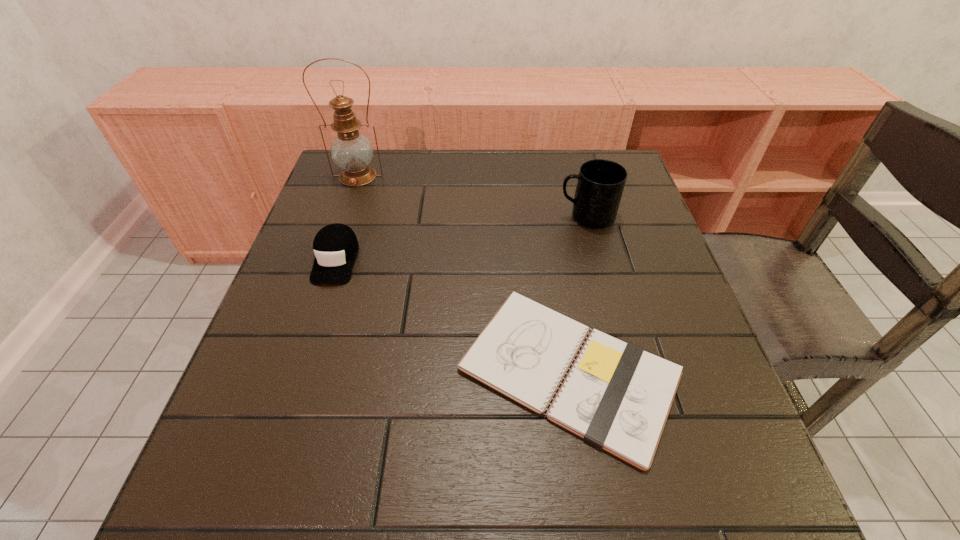
Identify the location of vacant area that lies between the nearest object and the cap. (452, 315).

Locate an element on the screen. The image size is (960, 540). free point between the oil lamp and the second farthest object is located at coordinates (472, 197).

You are a GUI agent. You are given a task and a screenshot of the screen. Output one action in this format:
    pyautogui.click(x=<x>, y=<y>)
    Task: Click on the empty space between the mug and the farthest object
    
    Given the screenshot: What is the action you would take?
    pyautogui.click(x=472, y=197)

Where is `free space that is in between the mug and the nearest object`? free space that is in between the mug and the nearest object is located at coordinates (578, 294).

Locate an element on the screen. free area in between the notepad and the mug is located at coordinates (578, 294).

In order to click on free point between the oil lamp and the nearest object in this screenshot , I will do `click(464, 274)`.

The image size is (960, 540). What are the coordinates of `free space between the tallest object and the third tallest object` in the screenshot? It's located at (347, 218).

At what (x,y) coordinates should I click in order to perform the action: click on object that stands as the third closest to the tallest object. Please return your answer as a coordinate pair (x, y). This screenshot has height=540, width=960. Looking at the image, I should click on (601, 182).

Image resolution: width=960 pixels, height=540 pixels. I want to click on the third closest object to the second farthest object, so click(335, 246).

Where is `free space that satisfies the following two spatial constraints: 1. on the front side of the oil lamp; 2. on the right side of the notepad`? The height and width of the screenshot is (540, 960). free space that satisfies the following two spatial constraints: 1. on the front side of the oil lamp; 2. on the right side of the notepad is located at coordinates point(291,371).